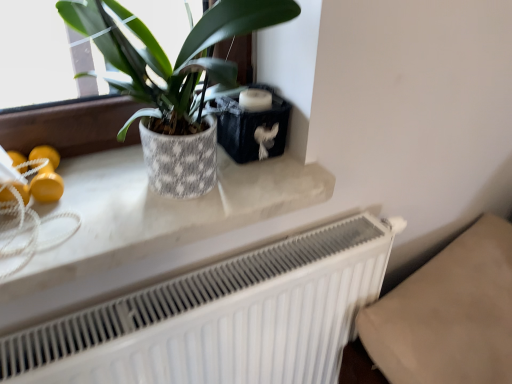
Question: In the image, is white matte radiator at lower center positioned in front of or behind textured ceramic pot at upper left?

Choices:
 (A) front
 (B) behind

Answer: (B)

Question: In terms of height, does white matte radiator at lower center look taller or shorter compared to textured ceramic pot at upper left?

Choices:
 (A) tall
 (B) short

Answer: (A)

Question: Estimate the real-world distances between objects in this image. Which object is farther from the white matte radiator at lower center?

Choices:
 (A) textured ceramic pot at upper left
 (B) white marble counter top at upper center

Answer: (A)

Question: Which object is the closest to the textured ceramic pot at upper left?

Choices:
 (A) white matte radiator at lower center
 (B) white marble counter top at upper center

Answer: (B)